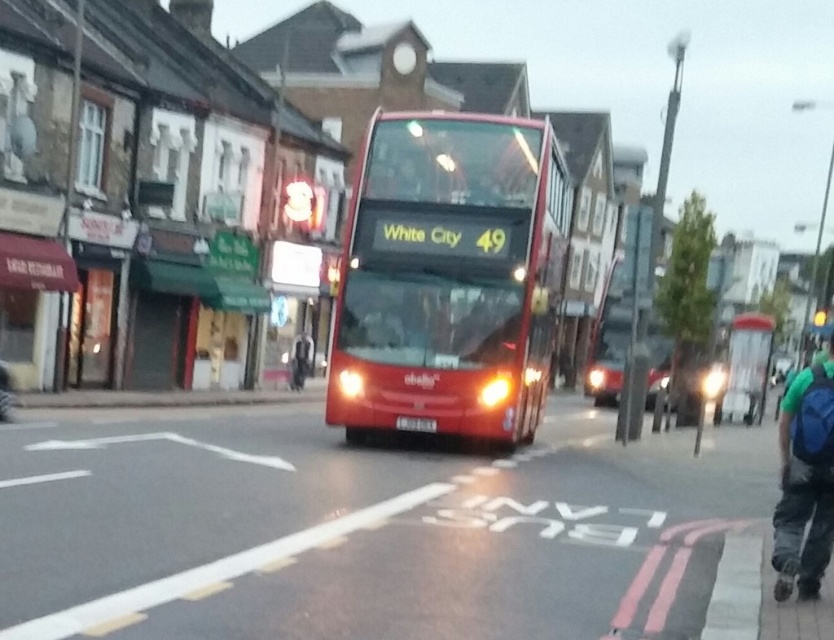
Question: Which of the following is the farthest from the observer?

Choices:
 (A) (821, 496)
 (B) (405, 164)

Answer: (B)

Question: Is shiny red bus at center smaller than blue backpack at lower right?

Choices:
 (A) no
 (B) yes

Answer: (B)

Question: Observing the image, what is the correct spatial positioning of shiny red bus at center in reference to blue backpack at lower right?

Choices:
 (A) left
 (B) right

Answer: (A)

Question: Can you confirm if shiny red bus at center is thinner than blue backpack at lower right?

Choices:
 (A) no
 (B) yes

Answer: (B)